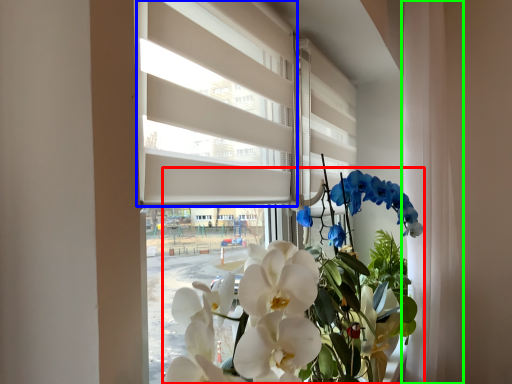
Question: Based on their relative distances, which object is farther from floral arrangement (highlighted by a red box)? Choose from blind (highlighted by a blue box) and curtain (highlighted by a green box).

Choices:
 (A) blind
 (B) curtain

Answer: (A)